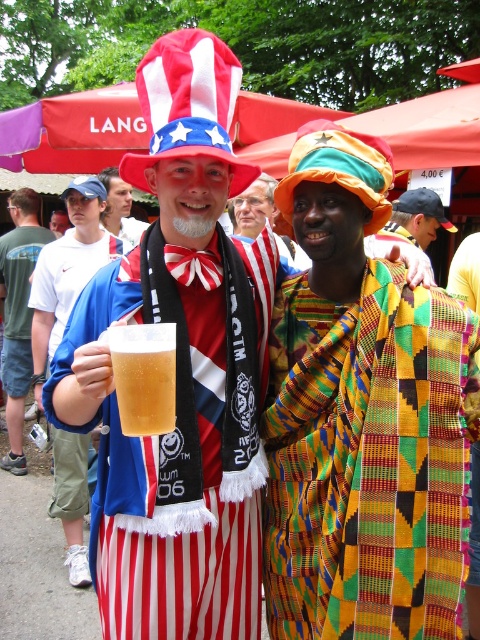
Question: Considering the real-world distances, which object is closest to the matte red and white striped hat at center?

Choices:
 (A) multicolored woven cloth at center
 (B) matte glass mug at center
 (C) matte red-white striped hat at center

Answer: (A)

Question: Which object is positioned closest to the golden amber liquid at center?

Choices:
 (A) kente cloth shawl at center
 (B) matte glass mug at center
 (C) translucent glass mug at center

Answer: (B)

Question: Is matte red and white striped hat at center below matte red-white striped hat at center?

Choices:
 (A) no
 (B) yes

Answer: (B)

Question: Is kente cloth shawl at center positioned behind matte red-white striped hat at center?

Choices:
 (A) yes
 (B) no

Answer: (B)

Question: Which point is closer to the camera?

Choices:
 (A) (28, 387)
 (B) (160, 314)
 (C) (420, 237)

Answer: (B)

Question: From the image, what is the correct spatial relationship of multicolored woven cloth at center in relation to matte red-white striped hat at center?

Choices:
 (A) right
 (B) left

Answer: (A)